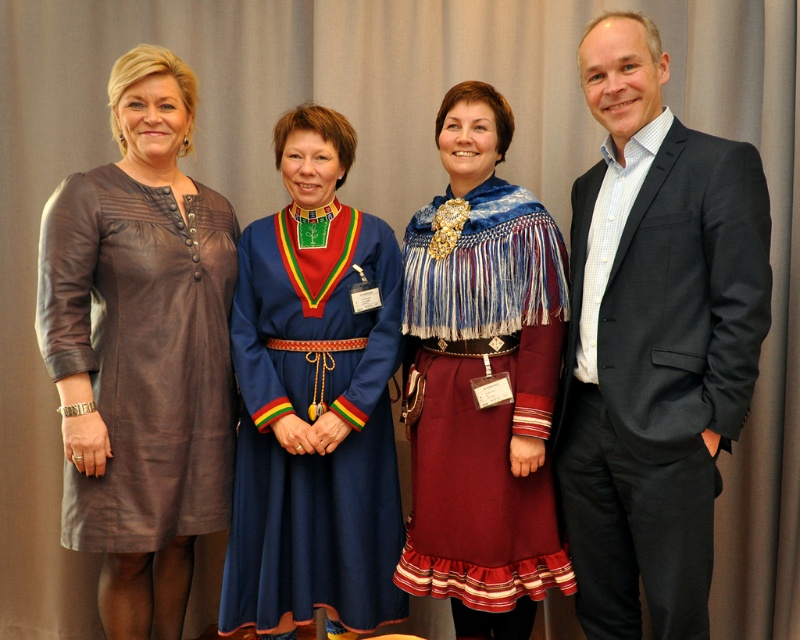
Question: Estimate the real-world distances between objects in this image. Which object is farther from the brown leather dress at left?

Choices:
 (A) blue fabric dress at center
 (B) dark gray suit at right
 (C) maroon fabric dress at center

Answer: (B)

Question: Considering the real-world distances, which object is farthest from the dark gray suit at right?

Choices:
 (A) maroon fabric dress at center
 (B) blue fabric dress at center
 (C) brown leather dress at left

Answer: (C)

Question: Can you confirm if blue fabric dress at center is thinner than brown leather dress at left?

Choices:
 (A) no
 (B) yes

Answer: (A)

Question: Which object is closer to the camera taking this photo?

Choices:
 (A) blue fabric dress at center
 (B) dark gray suit at right

Answer: (B)

Question: Does dark gray suit at right appear over blue fabric dress at center?

Choices:
 (A) yes
 (B) no

Answer: (A)

Question: Can you confirm if maroon fabric dress at center is thinner than brown leather dress at left?

Choices:
 (A) no
 (B) yes

Answer: (B)